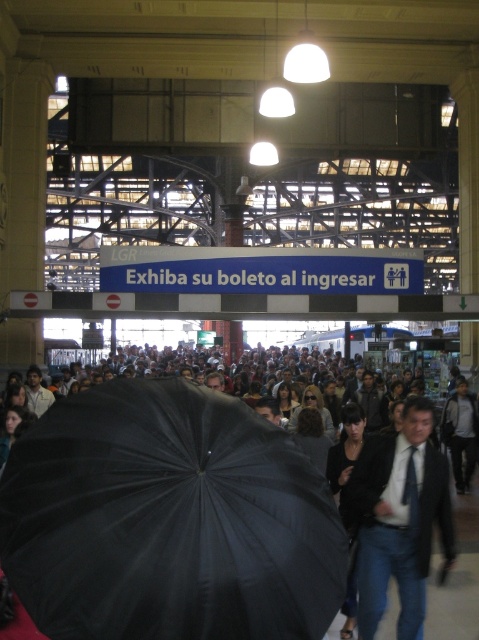
You are standing in the train station and notice a black matte umbrella at center and a dark blue suit at center. Which object takes up more space in the image?

The black matte umbrella at center is larger in size than the dark blue suit at center, so it takes up more space in the image.

You are standing in the train station and see the black matte umbrella at center and the dark blue suit at center. Which object is closer to the ceiling?

The black matte umbrella at center is closer to the ceiling because it is located above the dark blue suit at center.